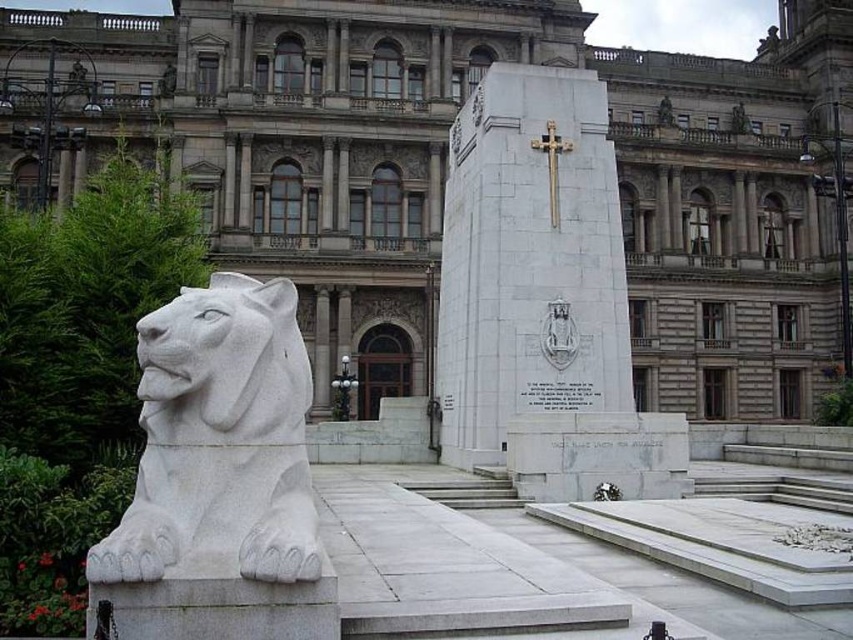
Question: Which of the following is the farthest from the observer?

Choices:
 (A) (180, 419)
 (B) (621, 276)

Answer: (B)

Question: Is white marble monument at center above white stone lion at left?

Choices:
 (A) no
 (B) yes

Answer: (B)

Question: Can you confirm if white marble monument at center is positioned to the right of white stone lion at left?

Choices:
 (A) yes
 (B) no

Answer: (A)

Question: Which of the following is the closest to the observer?

Choices:
 (A) white stone lion at left
 (B) white marble monument at center

Answer: (A)

Question: Is white marble monument at center below white stone lion at left?

Choices:
 (A) no
 (B) yes

Answer: (A)